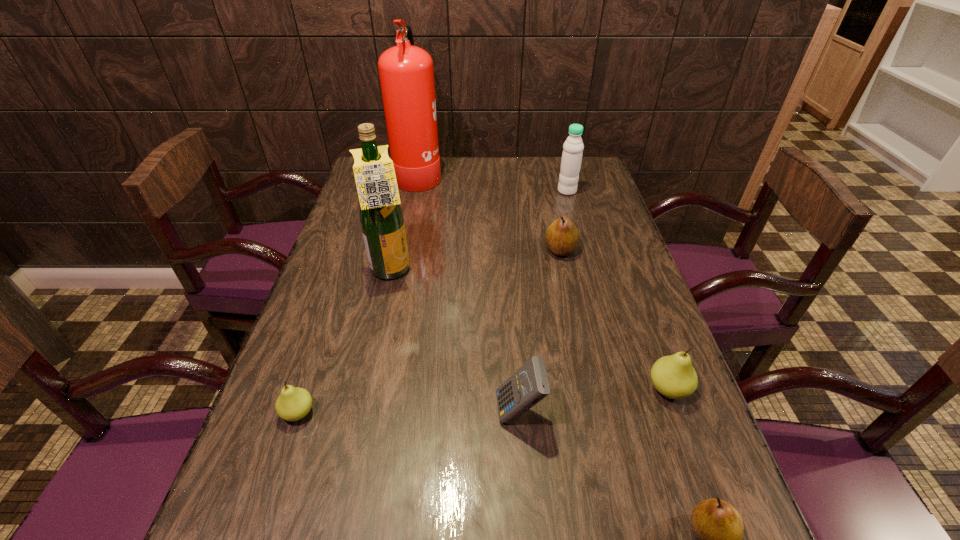
The height and width of the screenshot is (540, 960). I want to click on the leftmost pear, so click(x=293, y=403).

The height and width of the screenshot is (540, 960). What are the coordinates of `the smaller green pear` in the screenshot? It's located at (293, 403).

Image resolution: width=960 pixels, height=540 pixels. What are the coordinates of `vacant space located 0.110m towards the nozzle of the red fire extinguisher` in the screenshot? It's located at (472, 173).

This screenshot has width=960, height=540. I want to click on vacant area situated 0.190m on the front-facing side of the liquor, so click(484, 272).

The height and width of the screenshot is (540, 960). What are the coordinates of `blank space located on the front of the water bottle` in the screenshot? It's located at (577, 226).

Where is `vacant position located 0.130m on the front-facing side of the blue calculator`? This screenshot has width=960, height=540. vacant position located 0.130m on the front-facing side of the blue calculator is located at coordinates (431, 413).

In order to click on free location located 0.090m on the front-facing side of the blue calculator in this screenshot , I will do `click(451, 413)`.

Find the location of `free spot located 0.150m on the front-facing side of the blue calculator`. free spot located 0.150m on the front-facing side of the blue calculator is located at coordinates (421, 413).

Where is `free region located on the left of the farthest pear`? The width and height of the screenshot is (960, 540). free region located on the left of the farthest pear is located at coordinates (502, 250).

In order to click on vacant region located on the left of the bigger green pear in this screenshot , I will do `click(513, 389)`.